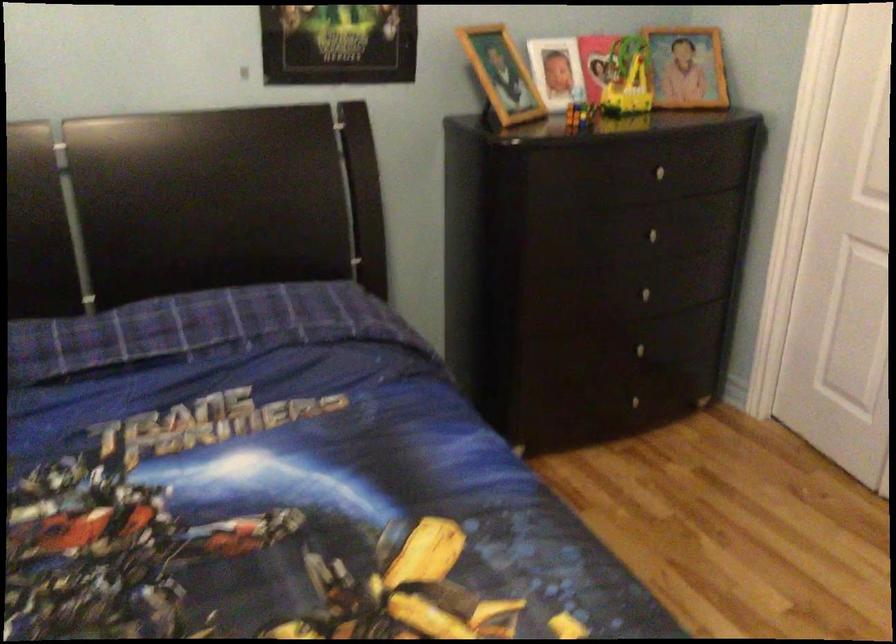
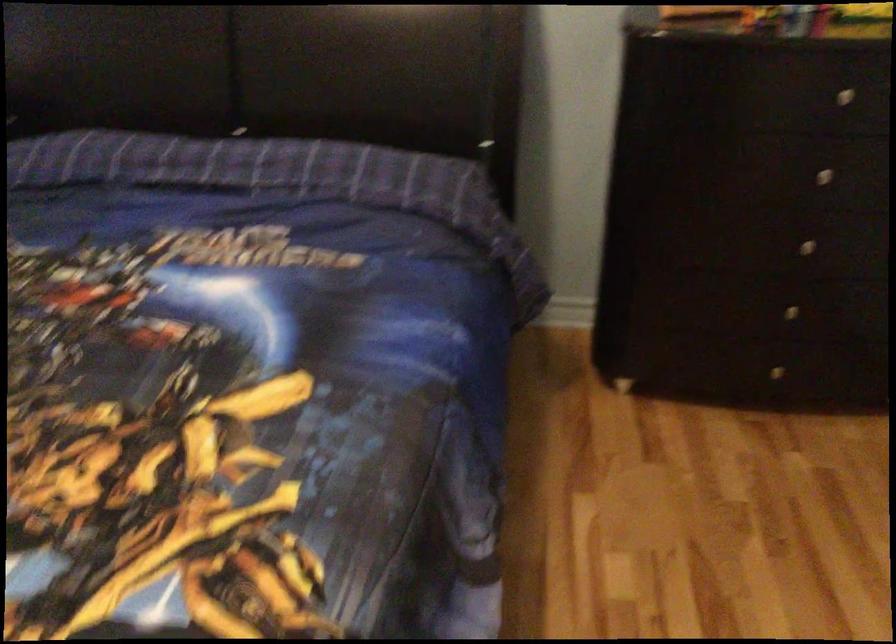
Find the pixel in the second image that matches the point at 650,292 in the first image.

(805, 245)